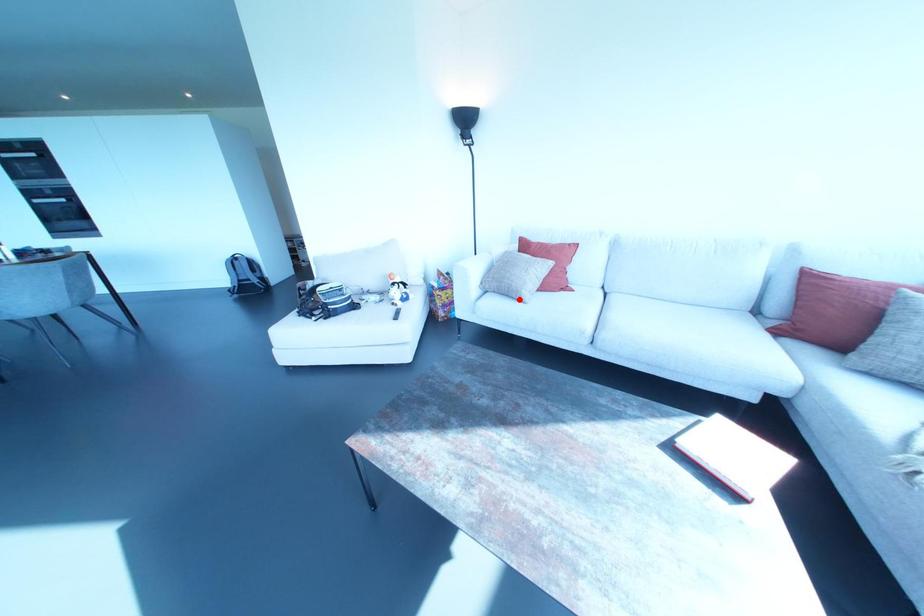
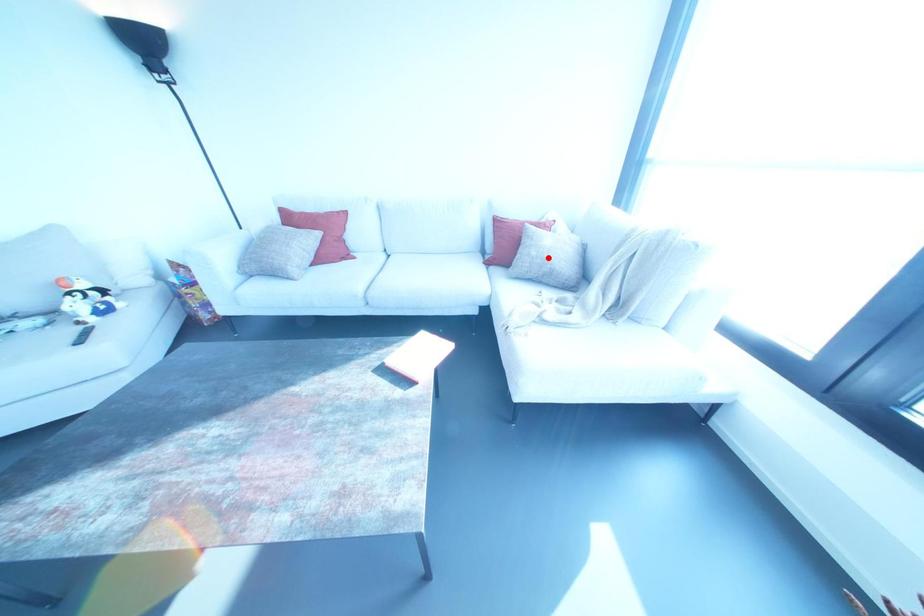
I am providing you with two images of the same scene from different viewpoints. A red point is marked on the first image and another point is marked on the second image. Are the points marked in image1 and image2 representing the same 3D position?

No